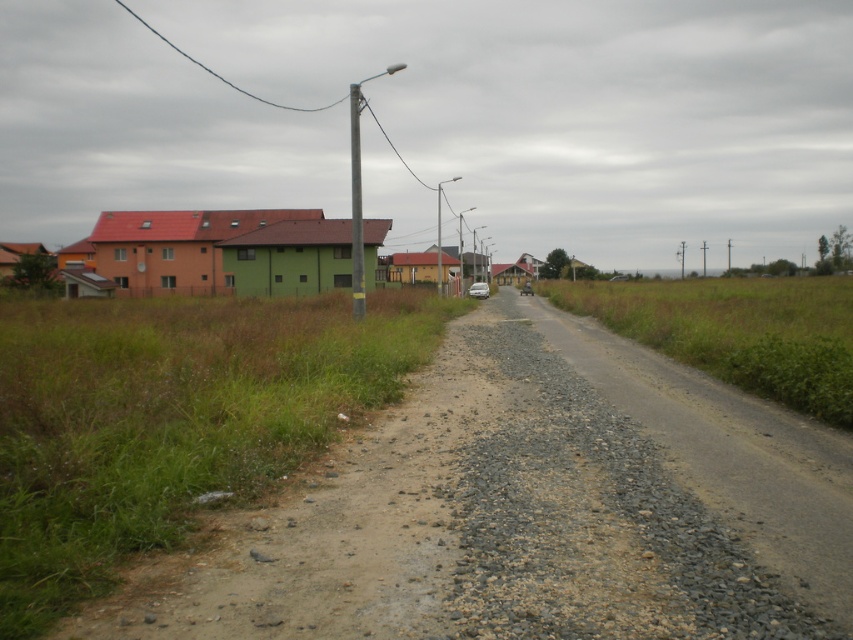
Question: Observing the image, what is the correct spatial positioning of brown gravel dirt track at center in reference to matte silver car at center?

Choices:
 (A) below
 (B) above

Answer: (A)

Question: Which point appears farthest from the camera in this image?

Choices:
 (A) (521, 291)
 (B) (473, 294)
 (C) (236, 552)
 (D) (358, 88)

Answer: (D)

Question: Which point is farther from the camera taking this photo?

Choices:
 (A) (360, 195)
 (B) (471, 296)

Answer: (A)

Question: Is metallic gray pole at center thinner than matte silver car at center?

Choices:
 (A) no
 (B) yes

Answer: (A)

Question: Is brown gravel dirt track at center behind metallic gray pole at center?

Choices:
 (A) yes
 (B) no

Answer: (B)

Question: Considering the real-world distances, which object is farthest from the metallic gray pole at center?

Choices:
 (A) matte silver car at center
 (B) brown gravel dirt track at center

Answer: (A)